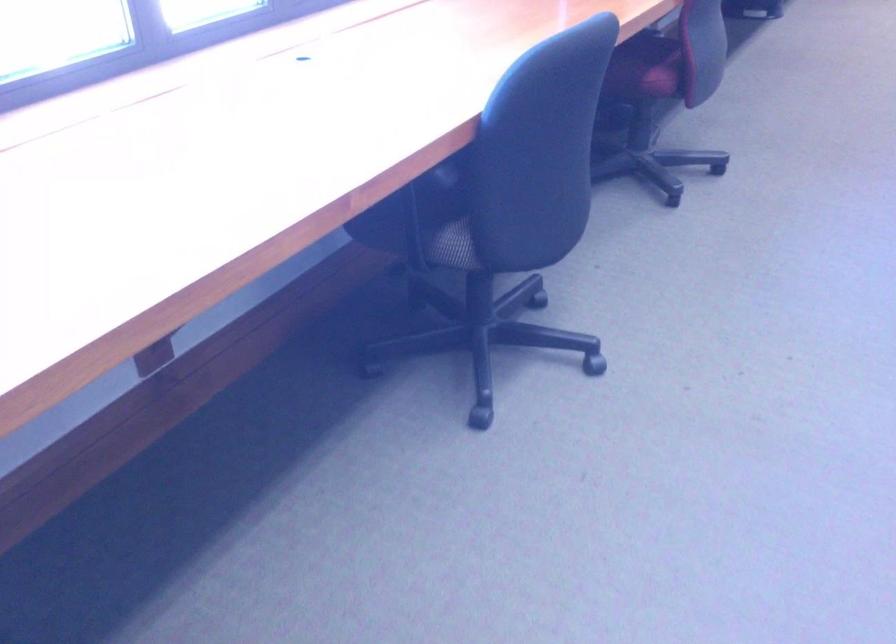
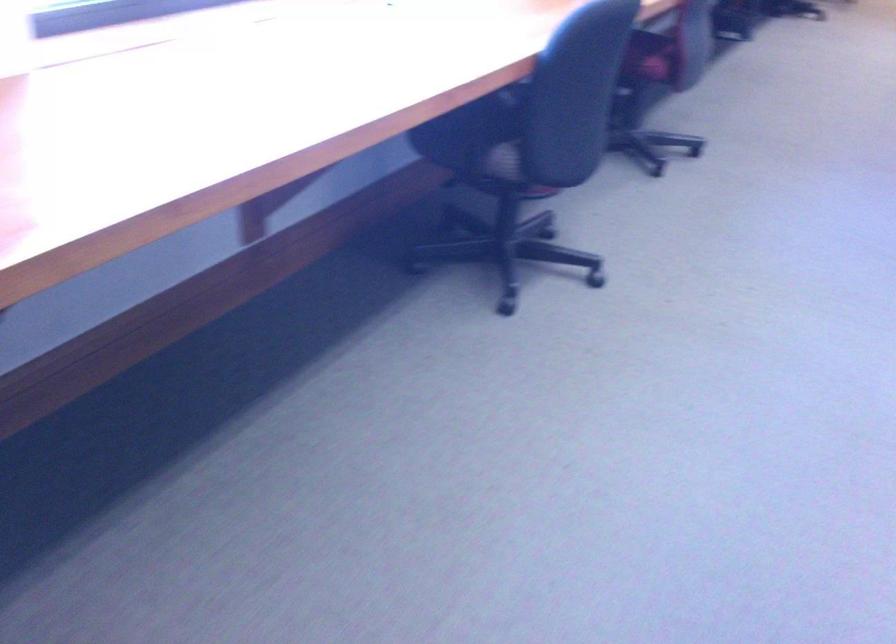
Question: Based on the continuous images, in which direction is the camera rotating? Reply with the corresponding letter.

Choices:
 (A) Left
 (B) Right
 (C) Up
 (D) Down

Answer: (B)